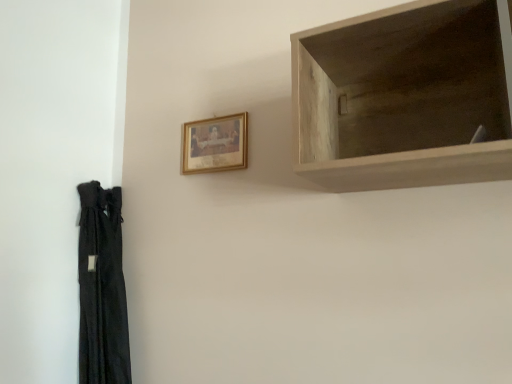
Question: From a real-world perspective, is gold-framed picture at upper center on top of light wood shelf at upper right?

Choices:
 (A) yes
 (B) no

Answer: (A)

Question: Can you confirm if gold-framed picture at upper center is positioned to the right of light wood shelf at upper right?

Choices:
 (A) no
 (B) yes

Answer: (A)

Question: Is gold-framed picture at upper center located outside light wood shelf at upper right?

Choices:
 (A) yes
 (B) no

Answer: (A)

Question: From the image's perspective, would you say gold-framed picture at upper center is shown under light wood shelf at upper right?

Choices:
 (A) yes
 (B) no

Answer: (A)

Question: Does gold-framed picture at upper center have a lesser width compared to light wood shelf at upper right?

Choices:
 (A) yes
 (B) no

Answer: (A)

Question: From a real-world perspective, is gold-framed picture at upper center physically below light wood shelf at upper right?

Choices:
 (A) no
 (B) yes

Answer: (A)

Question: Is gold-framed picture at upper center a part of light wood shelf at upper right?

Choices:
 (A) no
 (B) yes

Answer: (A)

Question: Is light wood shelf at upper right thinner than gold-framed picture at upper center?

Choices:
 (A) yes
 (B) no

Answer: (B)

Question: Considering the relative positions of light wood shelf at upper right and gold-framed picture at upper center in the image provided, is light wood shelf at upper right to the left of gold-framed picture at upper center from the viewer's perspective?

Choices:
 (A) yes
 (B) no

Answer: (B)

Question: From a real-world perspective, does light wood shelf at upper right stand above gold-framed picture at upper center?

Choices:
 (A) yes
 (B) no

Answer: (B)

Question: From the image's perspective, does light wood shelf at upper right appear higher than gold-framed picture at upper center?

Choices:
 (A) yes
 (B) no

Answer: (A)

Question: Is light wood shelf at upper right to the right of gold-framed picture at upper center from the viewer's perspective?

Choices:
 (A) no
 (B) yes

Answer: (B)

Question: Looking at their shapes, would you say light wood shelf at upper right is wider or thinner than gold-framed picture at upper center?

Choices:
 (A) thin
 (B) wide

Answer: (B)